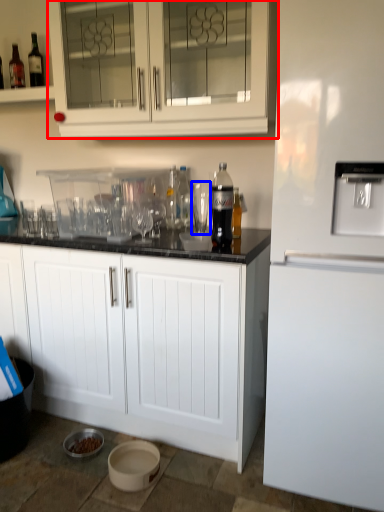
Question: Among these objects, which one is farthest to the camera, cabinetry (highlighted by a red box) or shot glass (highlighted by a blue box)?

Choices:
 (A) cabinetry
 (B) shot glass

Answer: (B)